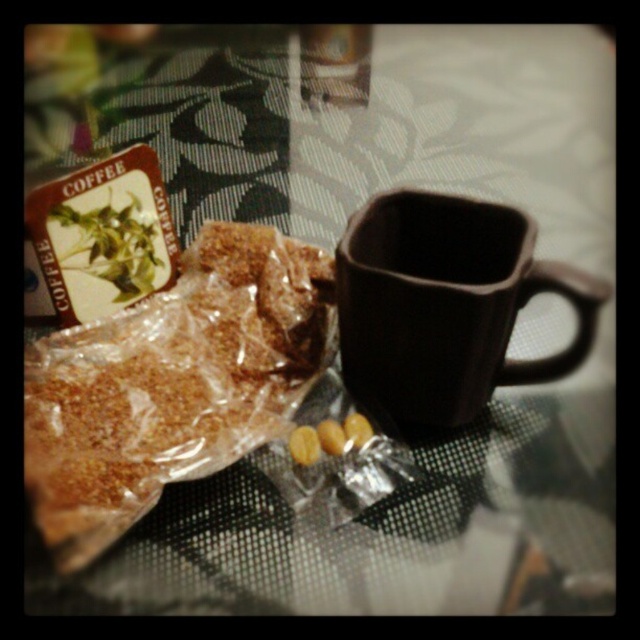
Question: Can you confirm if brown crumbly snack at center-left is positioned above matte brown mug at center?

Choices:
 (A) no
 (B) yes

Answer: (A)

Question: Which point is closer to the camera taking this photo?

Choices:
 (A) (452, 364)
 (B) (177, 433)

Answer: (A)

Question: Does brown crumbly snack at center-left have a lesser width compared to matte brown mug at center?

Choices:
 (A) yes
 (B) no

Answer: (B)

Question: Is brown crumbly snack at center-left bigger than matte brown mug at center?

Choices:
 (A) no
 (B) yes

Answer: (B)

Question: Among these points, which one is farthest from the camera?

Choices:
 (A) (276, 388)
 (B) (358, 221)

Answer: (A)

Question: Which point is farther to the camera?

Choices:
 (A) (385, 292)
 (B) (65, 532)

Answer: (B)